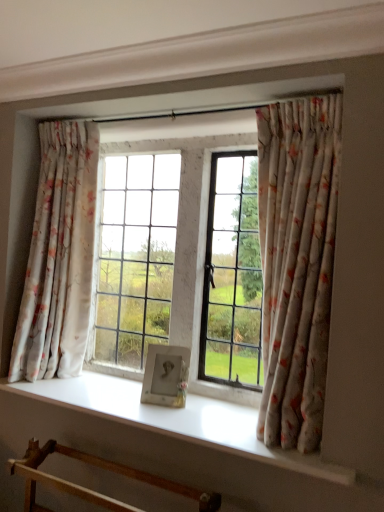
The width and height of the screenshot is (384, 512). Find the location of `empty space that is ontop of white smooth window sill at center (from a real-world perspective)`. empty space that is ontop of white smooth window sill at center (from a real-world perspective) is located at coordinates (148, 402).